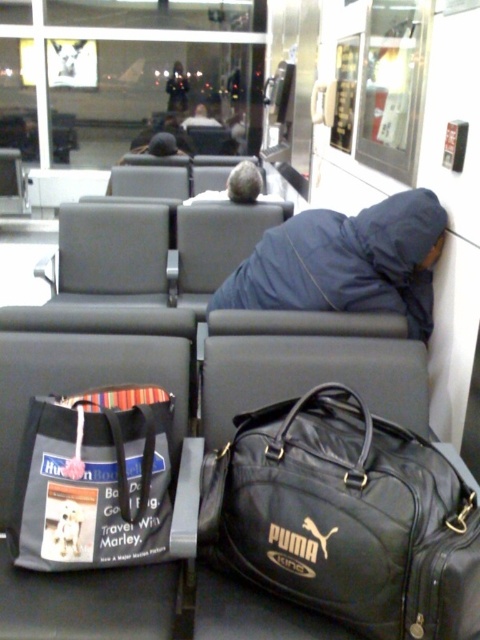
You are a security guard at the station and need to locate the gray fabric tote bag at lower left. According to the coordinates provided, where should you look to find it?

The gray fabric tote bag at lower left is located at coordinates point (x=94, y=480).

From the picture: You are a traveler who just arrived at the waiting area. You want to place your new backpack between the black leather duffel at center and the blue fabric person at center. Is there enough space between them for your backpack?

The black leather duffel at center is below the blue fabric person at center, so there is vertical space between them. However, since the blue fabric person at center is sitting, placing a backpack between them might not be feasible as the person is occupying the seat. Please check the horizontal space available on the seat next to them instead.

You are a traveler who needs to pack your luggage. You have both the black leather duffel at center and the gray fabric tote bag at lower left. Which one can hold more items?

The black leather duffel at center is larger in size than the gray fabric tote bag at lower left, so it can hold more items.